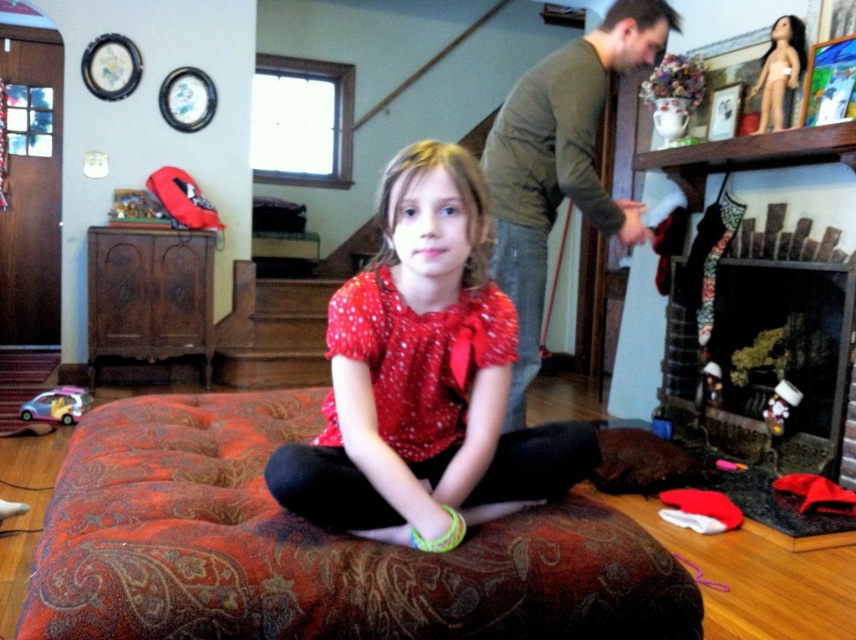
Who is shorter, matte red blouse at center or green cotton shirt at upper right?

Standing shorter between the two is matte red blouse at center.

Does matte red blouse at center have a smaller size compared to green cotton shirt at upper right?

Yes.

Is point (479, 512) positioned behind point (538, 76)?

No, it is not.

In order to click on matte red blouse at center in this screenshot , I will do `click(424, 378)`.

Can you confirm if matte red blouse at center is positioned above black glass fireplace at lower right?

Yes.

What do you see at coordinates (424, 378) in the screenshot? This screenshot has height=640, width=856. I see `matte red blouse at center` at bounding box center [424, 378].

Where is `matte red blouse at center`? The height and width of the screenshot is (640, 856). matte red blouse at center is located at coordinates (424, 378).

Which is more to the right, velvet-patterned dog bed at center or black glass fireplace at lower right?

black glass fireplace at lower right is more to the right.

In the scene shown: Is velvet-patterned dog bed at center bigger than black glass fireplace at lower right?

Correct, velvet-patterned dog bed at center is larger in size than black glass fireplace at lower right.

At what (x,y) coordinates should I click in order to perform the action: click on velvet-patterned dog bed at center. Please return your answer as a coordinate pair (x, y). The width and height of the screenshot is (856, 640). Looking at the image, I should click on (310, 547).